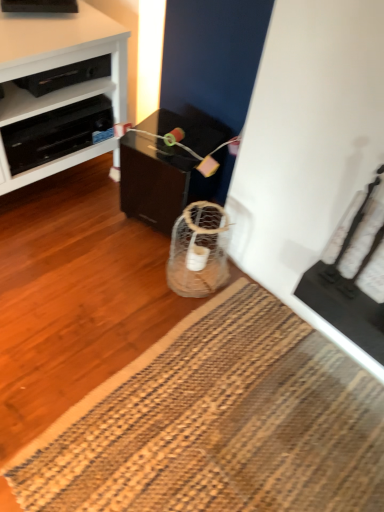
This screenshot has width=384, height=512. I want to click on free spot above black glossy table at center (from a real-world perspective), so click(167, 140).